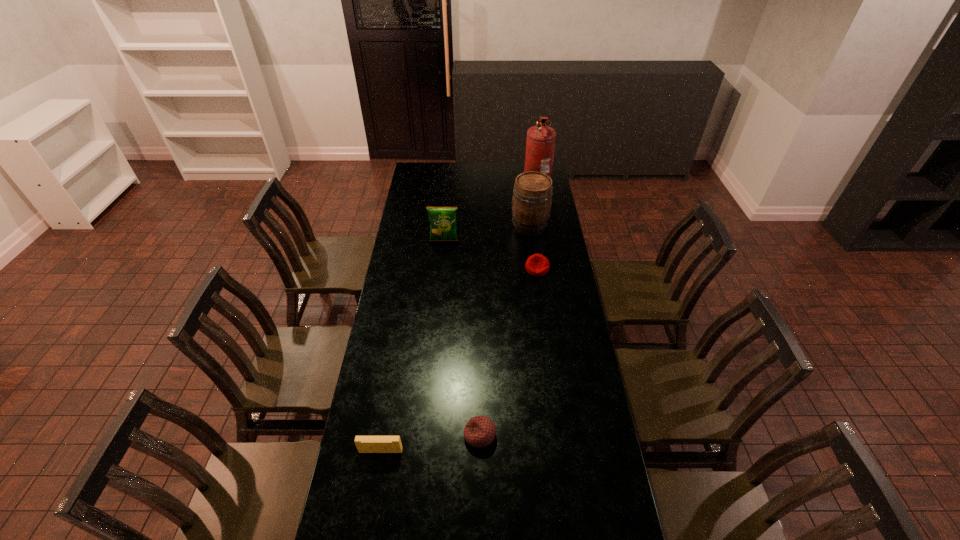
Point out which beanbag is positioned as the second nearest to the fifth object from right to left. Please provide its 2D coordinates. Your answer should be formatted as a tuple, i.e. [(x, y)], where the tuple contains the x and y coordinates of a point satisfying the conditions above.

[(479, 431)]

The image size is (960, 540). Identify the location of vacant area in the image that satisfies the following two spatial constraints: 1. on the side of the second tallest object near the bung hole; 2. at the front of the videotape with spools. (559, 451).

Locate an element on the screen. This screenshot has height=540, width=960. vacant region that satisfies the following two spatial constraints: 1. on the side of the cider near the bung hole; 2. on the front-facing side of the second object from left to right is located at coordinates point(532,241).